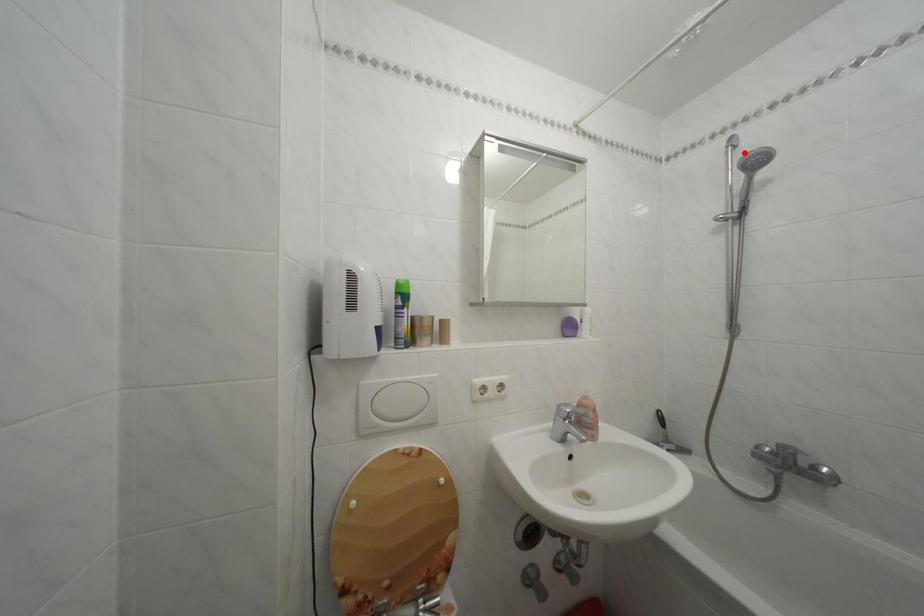
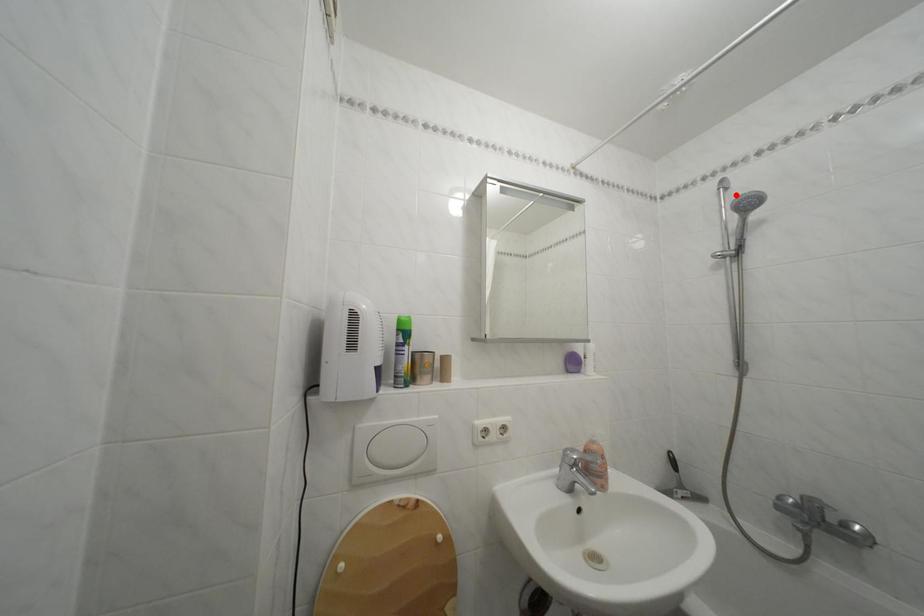
I am providing you with two images of the same scene from different viewpoints. A red point is marked on the first image and another point is marked on the second image. Are the points marked in image1 and image2 representing the same 3D position?

Yes